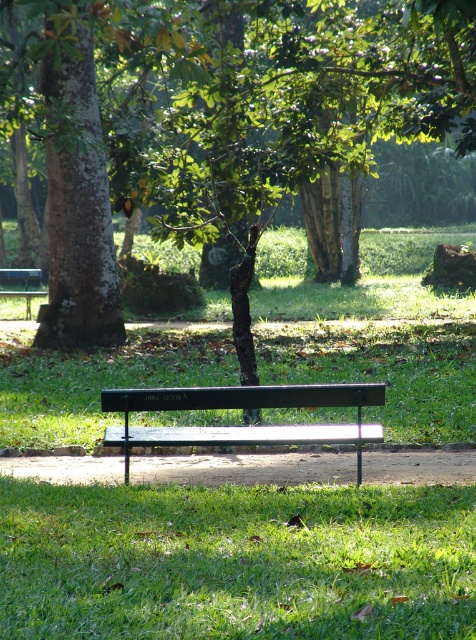
Question: Is green metallic bench at center to the right of green matte bench at center from the viewer's perspective?

Choices:
 (A) yes
 (B) no

Answer: (A)

Question: Does green metallic bench at center have a greater width compared to green grass at lower center?

Choices:
 (A) no
 (B) yes

Answer: (B)

Question: Which point is closer to the camera?

Choices:
 (A) (118, 301)
 (B) (199, 147)

Answer: (A)

Question: Which is farther from the green grass at lower center?

Choices:
 (A) rough bark tree at left
 (B) green matte bench at center

Answer: (B)

Question: Based on their relative distances, which object is nearer to the green metallic bench at center?

Choices:
 (A) brown rough tree at center
 (B) metallic green bench at center
 (C) green matte bench at center

Answer: (B)

Question: Can you confirm if green metallic bench at center is thinner than green matte bench at center?

Choices:
 (A) no
 (B) yes

Answer: (A)